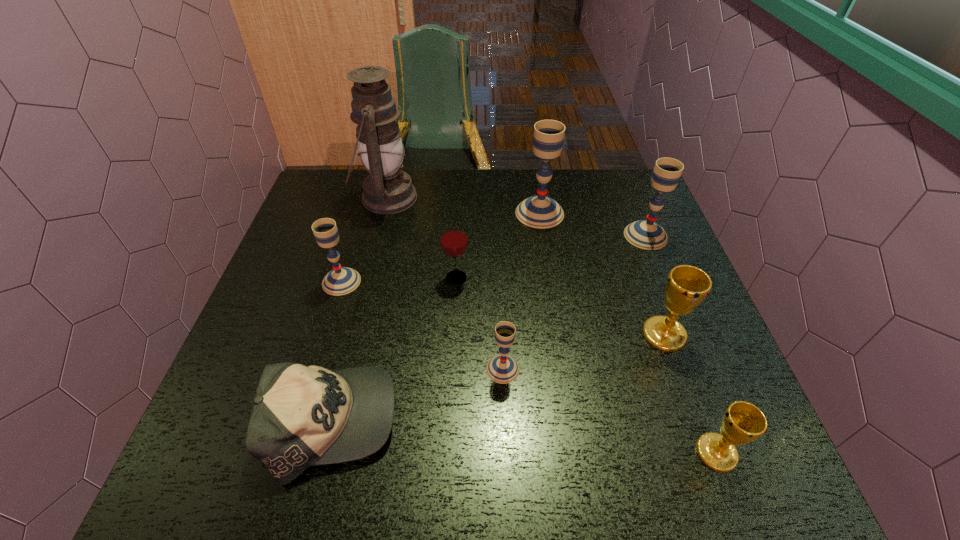
This screenshot has height=540, width=960. I want to click on free region that satisfies the following two spatial constraints: 1. on the back side of the fifth farthest chalice; 2. on the right side of the rightmost gray chalice, so click(497, 236).

This screenshot has width=960, height=540. What are the coordinates of `free space that satisfies the following two spatial constraints: 1. on the back side of the third smallest gray chalice; 2. on the left side of the nearest chalice` in the screenshot? It's located at coord(636,236).